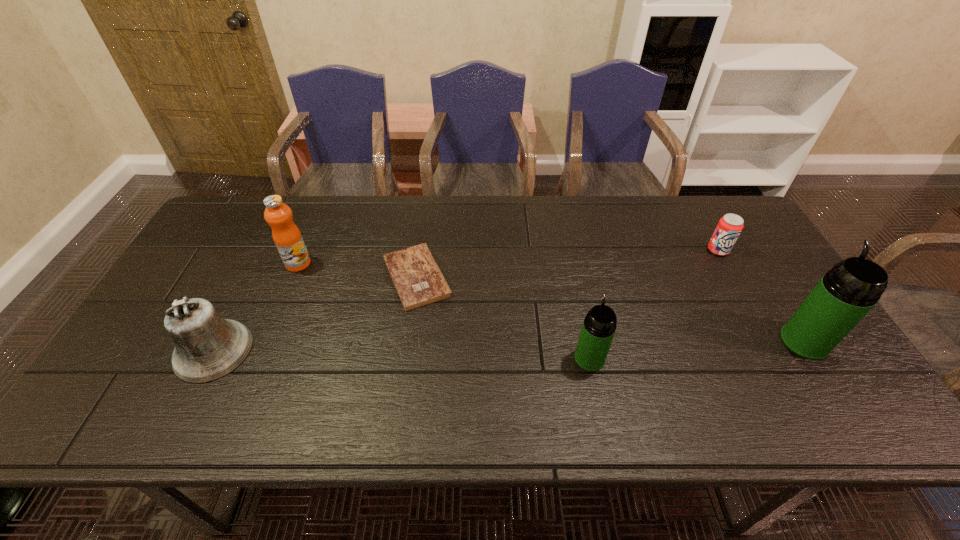
Considering the uniform spacing of thermos bottles, where should an additional thermos bottle be positioned on the left? Please locate a free spot. Please provide its 2D coordinates. Your answer should be formatted as a tuple, i.e. [(x, y)], where the tuple contains the x and y coordinates of a point satisfying the conditions above.

[(361, 376)]